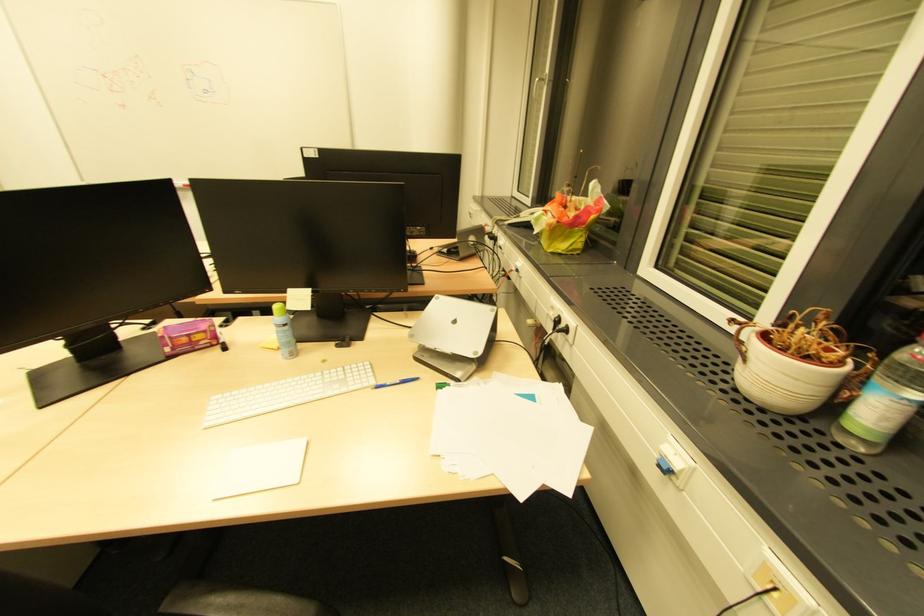
Where would you press the light blue spray can? Please return your answer as a coordinate pair (x, y).

(883, 402)